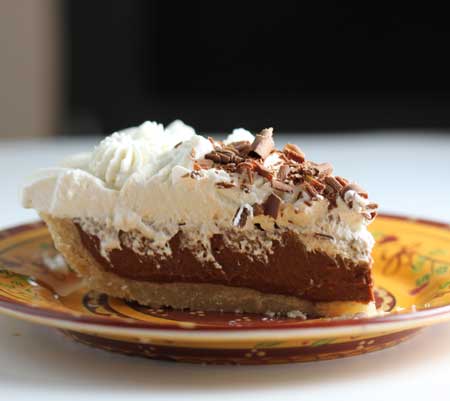
Identify the location of tabletop. (398, 174).